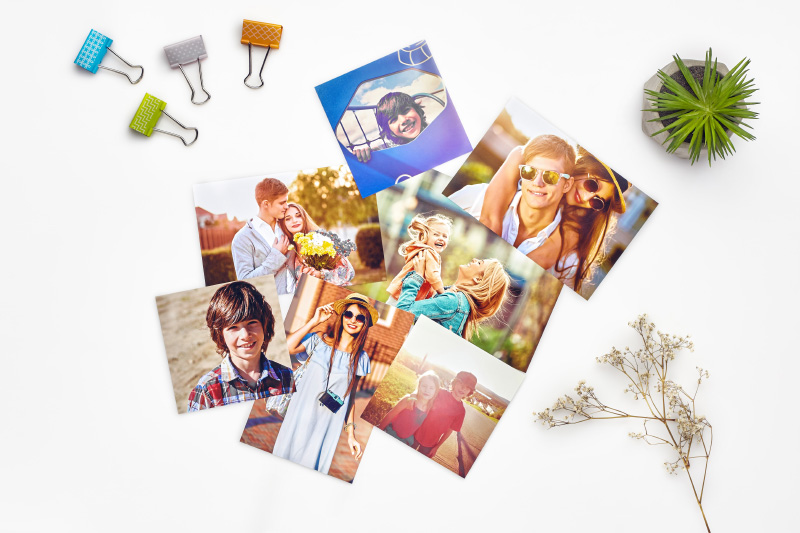
Where is `binder clips`? Image resolution: width=800 pixels, height=533 pixels. binder clips is located at coordinates (258, 28), (194, 51), (160, 102), (89, 36).